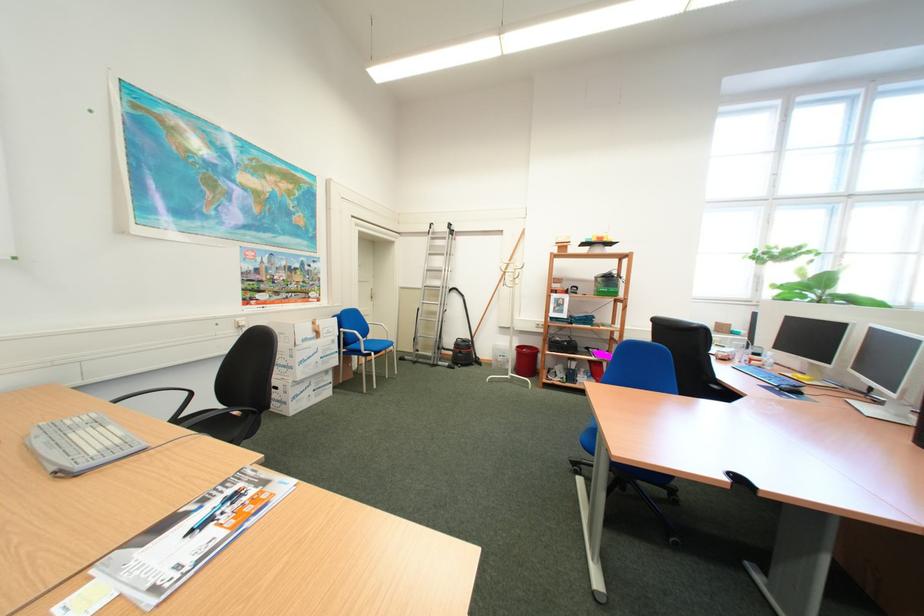
Describe the element at coordinates (383, 345) in the screenshot. This screenshot has width=924, height=616. I see `a blue chair sitting surface` at that location.